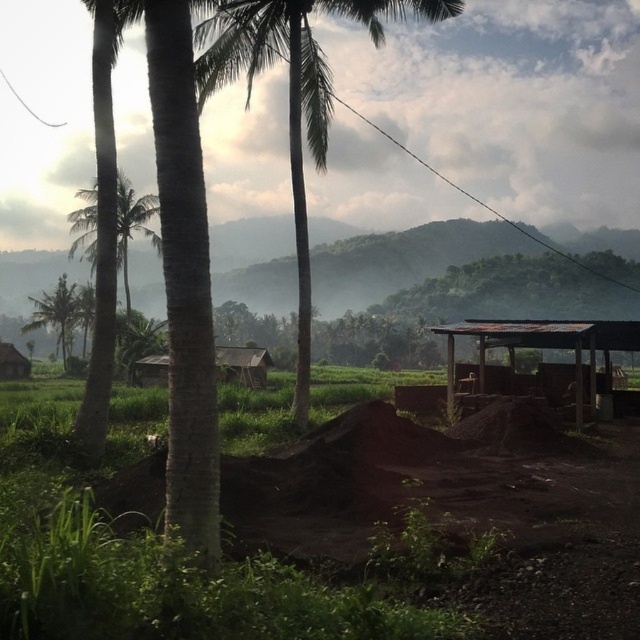
Who is positioned more to the left, rusty metal shelter at lower right or green leafy palm tree at upper left?

green leafy palm tree at upper left

At what (x,y) coordinates should I click in order to perform the action: click on rusty metal shelter at lower right. Please return your answer as a coordinate pair (x, y). This screenshot has width=640, height=640. Looking at the image, I should click on (545, 346).

Is point (524, 330) farther from camera compared to point (22, 332)?

No, (524, 330) is in front of (22, 332).

Locate an element on the screen. rusty metal shelter at lower right is located at coordinates (545, 346).

Who is shorter, brown wooden hut at center or brown wooden hut at lower left?

brown wooden hut at lower left is shorter.

From the picture: Does brown wooden hut at center have a lesser width compared to brown wooden hut at lower left?

In fact, brown wooden hut at center might be wider than brown wooden hut at lower left.

Measure the distance between brown wooden hut at center and camera.

5.70 meters

Image resolution: width=640 pixels, height=640 pixels. In order to click on brown wooden hut at center in this screenshot , I will do `click(243, 364)`.

Does point (56, 326) lie behind point (260, 362)?

Yes, it is behind point (260, 362).

Which is behind, point (49, 305) or point (264, 360)?

Point (49, 305)

Does point (67, 358) lie behind point (266, 355)?

Yes, it is.

Identify the location of green leafy palm tree at upper left. (61, 314).